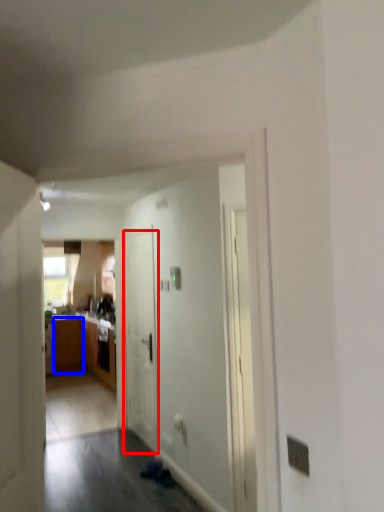
Question: Which object is closer to the camera taking this photo, door (highlighted by a red box) or cabinetry (highlighted by a blue box)?

Choices:
 (A) door
 (B) cabinetry

Answer: (A)